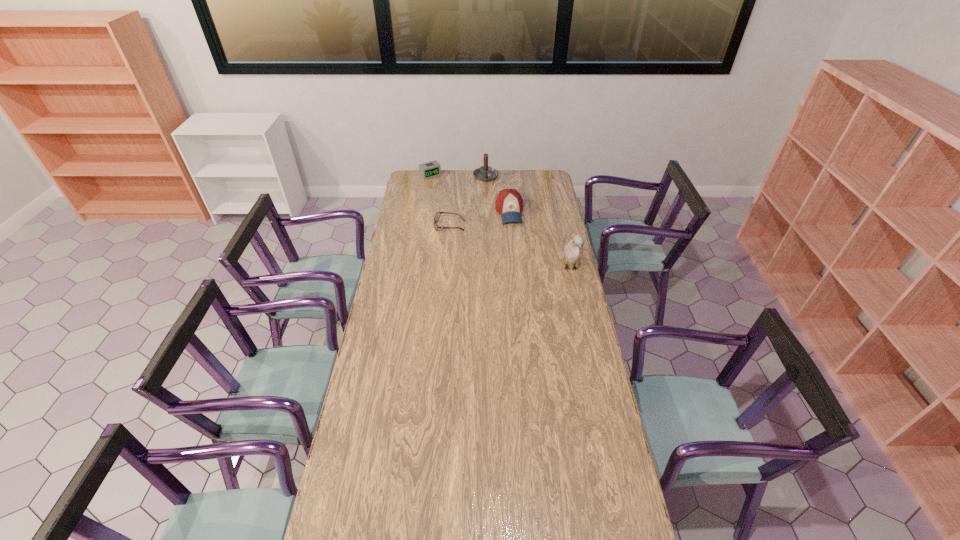
The width and height of the screenshot is (960, 540). Identify the location of object identified as the closest to the nearest object. (509, 203).

I want to click on vacant point that satisfies the following two spatial constraints: 1. on the front side of the third tallest object; 2. on the left side of the candle, so click(487, 212).

You are a GUI agent. You are given a task and a screenshot of the screen. Output one action in this format:
    pyautogui.click(x=<x>, y=<y>)
    Task: Click on the free region that satisfies the following two spatial constraints: 1. on the front side of the second shortest object; 2. on the left side of the baseball cap
    The width and height of the screenshot is (960, 540).
    Given the screenshot: What is the action you would take?
    pyautogui.click(x=424, y=212)

What are the coordinates of `vacant area that satisfies the following two spatial constraints: 1. on the front side of the second shortest object; 2. on the left side of the third shortest object` in the screenshot? It's located at (424, 212).